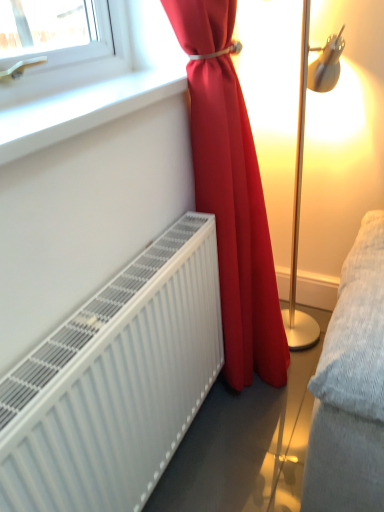
Measure the distance between white matte radiator at lower left and camera.

A distance of 25.74 inches exists between white matte radiator at lower left and camera.

At what (x,y) coordinates should I click in order to perform the action: click on white matte radiator at lower left. Please return your answer as a coordinate pair (x, y). Looking at the image, I should click on (116, 382).

This screenshot has width=384, height=512. Describe the element at coordinates (83, 110) in the screenshot. I see `white smooth window sill at upper left` at that location.

Where is `matte red curtain at center`? This screenshot has height=512, width=384. matte red curtain at center is located at coordinates (236, 224).

Considering the sizes of matte red curtain at center and white smooth window sill at upper left in the image, is matte red curtain at center bigger or smaller than white smooth window sill at upper left?

In the image, matte red curtain at center appears to be larger than white smooth window sill at upper left.

Does matte red curtain at center have a lesser height compared to white smooth window sill at upper left?

Incorrect, the height of matte red curtain at center does not fall short of that of white smooth window sill at upper left.

Looking at this image, is matte red curtain at center looking in the opposite direction of white smooth window sill at upper left?

Absolutely, matte red curtain at center is directed away from white smooth window sill at upper left.

Can you tell me how much matte red curtain at center and white smooth window sill at upper left differ in facing direction?

There is a 2.26-degree angle between the facing directions of matte red curtain at center and white smooth window sill at upper left.

Looking at this image, would you say white smooth window sill at upper left is outside matte red curtain at center?

That's correct, white smooth window sill at upper left is outside of matte red curtain at center.

Considering the relative positions of white smooth window sill at upper left and matte red curtain at center in the image provided, is white smooth window sill at upper left to the left of matte red curtain at center from the viewer's perspective?

Yes.

Is white smooth window sill at upper left not near matte red curtain at center?

No, white smooth window sill at upper left is not far from matte red curtain at center.

Does white smooth window sill at upper left come in front of matte red curtain at center?

Yes, white smooth window sill at upper left is in front of matte red curtain at center.

Which is in front, white matte radiator at lower left or matte red curtain at center?

white matte radiator at lower left is closer to the camera.

Considering the relative sizes of white matte radiator at lower left and matte red curtain at center in the image provided, is white matte radiator at lower left wider than matte red curtain at center?

No, white matte radiator at lower left is not wider than matte red curtain at center.

From the picture: Considering the sizes of white matte radiator at lower left and matte red curtain at center in the image, is white matte radiator at lower left bigger or smaller than matte red curtain at center?

In the image, white matte radiator at lower left appears to be smaller than matte red curtain at center.

Is point (203, 10) less distant than point (134, 284)?

No.

Which object is further away from the camera, matte red curtain at center or white matte radiator at lower left?

matte red curtain at center is further from the camera.

Can you see matte red curtain at center touching white matte radiator at lower left?

No, matte red curtain at center is not touching white matte radiator at lower left.

From the image's perspective, would you say white smooth window sill at upper left is shown under white matte radiator at lower left?

No, from the image's perspective, white smooth window sill at upper left is not beneath white matte radiator at lower left.

Between white smooth window sill at upper left and white matte radiator at lower left, which one has larger width?

Wider between the two is white smooth window sill at upper left.

Which of these two, white smooth window sill at upper left or white matte radiator at lower left, stands taller?

With more height is white matte radiator at lower left.

Who is bigger, white smooth window sill at upper left or white matte radiator at lower left?

With larger size is white matte radiator at lower left.

Is white matte radiator at lower left not near white smooth window sill at upper left?

white matte radiator at lower left is actually quite close to white smooth window sill at upper left.

Is white matte radiator at lower left bigger or smaller than white smooth window sill at upper left?

white matte radiator at lower left is bigger than white smooth window sill at upper left.

Which of these two, white matte radiator at lower left or white smooth window sill at upper left, stands taller?

Standing taller between the two is white matte radiator at lower left.

From the image's perspective, which object appears higher, white matte radiator at lower left or white smooth window sill at upper left?

white smooth window sill at upper left appears higher in the image.

Locate an element on the screen. Image resolution: width=384 pixels, height=512 pixels. curtain behind the white smooth window sill at upper left is located at coordinates (236, 224).

Find the location of `window sill that appears above the matte red curtain at center (from the image's perspective)`. window sill that appears above the matte red curtain at center (from the image's perspective) is located at coordinates (83, 110).

When comparing their distances from white smooth window sill at upper left, does matte red curtain at center or white matte radiator at lower left seem closer?

Among the two, matte red curtain at center is located nearer to white smooth window sill at upper left.

When comparing their distances from white matte radiator at lower left, does matte red curtain at center or white smooth window sill at upper left seem closer?

matte red curtain at center is positioned closer to the anchor white matte radiator at lower left.

From the image, which object appears to be nearer to white smooth window sill at upper left, white matte radiator at lower left or matte red curtain at center?

matte red curtain at center is closer to white smooth window sill at upper left.

Estimate the real-world distances between objects in this image. Which object is closer to white matte radiator at lower left, white smooth window sill at upper left or matte red curtain at center?

matte red curtain at center is positioned closer to the anchor white matte radiator at lower left.

From the image, which object appears to be nearer to matte red curtain at center, white matte radiator at lower left or white smooth window sill at upper left?

The object closer to matte red curtain at center is white matte radiator at lower left.

Looking at the image, which one is located further to matte red curtain at center, white smooth window sill at upper left or white matte radiator at lower left?

white smooth window sill at upper left lies further to matte red curtain at center than the other object.

Where is `curtain between white smooth window sill at upper left and white matte radiator at lower left in the up-down direction`? The image size is (384, 512). curtain between white smooth window sill at upper left and white matte radiator at lower left in the up-down direction is located at coordinates (236, 224).